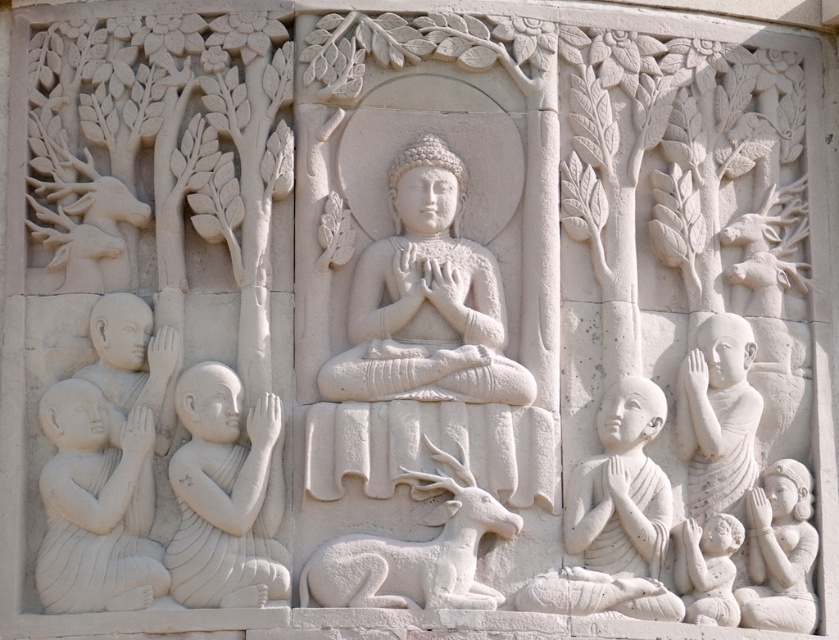
You are an art conservator examining this stone relief sculpture. You need to determine which of the two figures, the white stone child at lower left or the white stone monk at right, requires more space for restoration work. Based on the sculpture, which figure would need a larger workspace?

The white stone monk at right requires a larger workspace because it occupies more space than the white stone child at lower left.